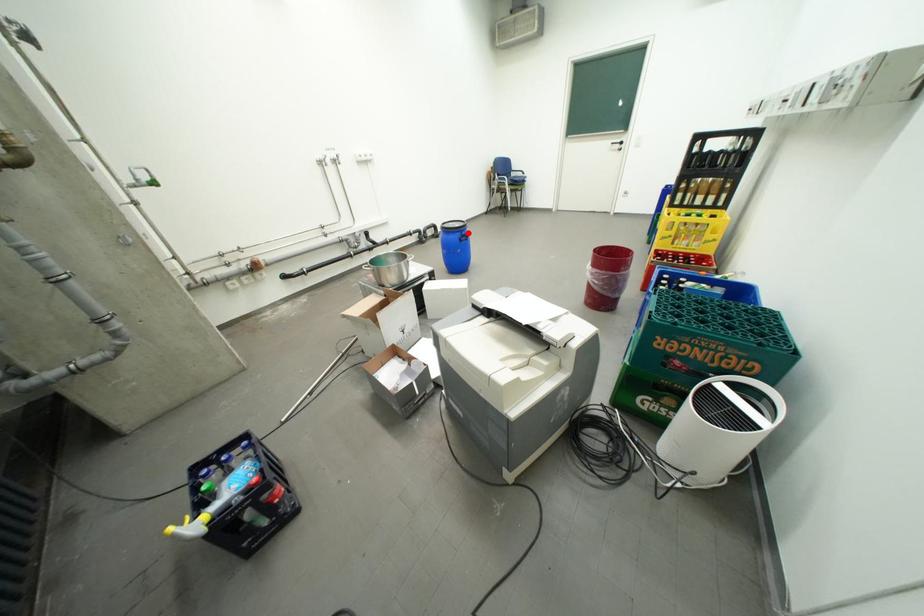
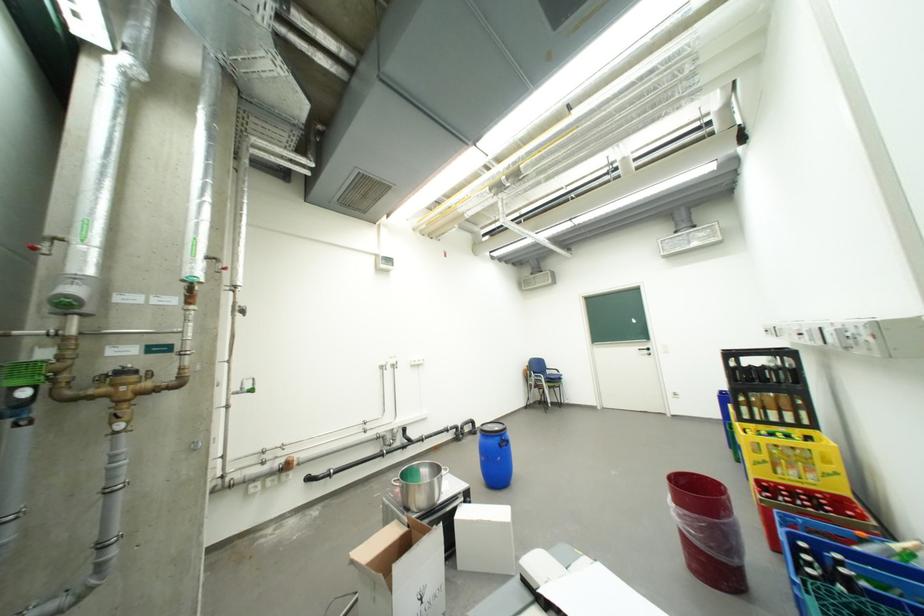
The point at the highlighted location is marked in the first image. Where is the corresponding point in the second image?

(507, 438)